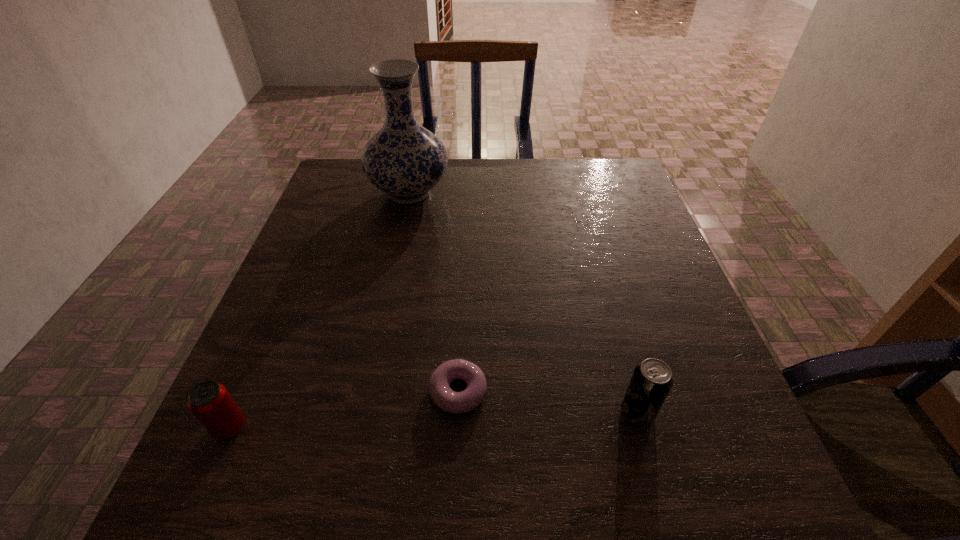
In the image, there is a desktop. Identify the location of vacant space at the far right corner. The image size is (960, 540). 583,192.

The image size is (960, 540). Find the location of `vacant space in between the third tallest object and the shortest object`. vacant space in between the third tallest object and the shortest object is located at coordinates click(344, 410).

The image size is (960, 540). Find the location of `unoccupied area between the shortest object and the rightmost object`. unoccupied area between the shortest object and the rightmost object is located at coordinates point(547,402).

The image size is (960, 540). I want to click on empty space between the soda can and the farthest object, so click(523, 302).

This screenshot has height=540, width=960. Find the location of `empty space between the doughnut and the soda can`. empty space between the doughnut and the soda can is located at coordinates (547, 402).

This screenshot has width=960, height=540. I want to click on blank region between the doughnut and the soda can, so click(547, 402).

Locate an element on the screen. The height and width of the screenshot is (540, 960). vacant point located between the shortest object and the third tallest object is located at coordinates (344, 410).

Find the location of `vacant area that lies between the tallest object and the rightmost object`. vacant area that lies between the tallest object and the rightmost object is located at coordinates (523, 302).

At what (x,y) coordinates should I click in order to perform the action: click on empty space that is in between the rightmost object and the shortest object. Please return your answer as a coordinate pair (x, y). The width and height of the screenshot is (960, 540). Looking at the image, I should click on (547, 402).

I want to click on free space between the rightmost object and the shortest object, so click(x=547, y=402).